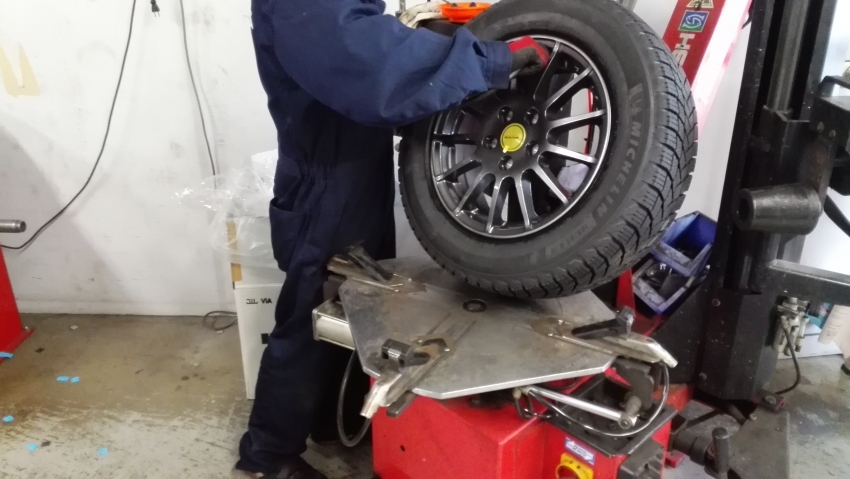
What are the coordinates of `background white wall left of person` in the screenshot? It's located at (140, 184).